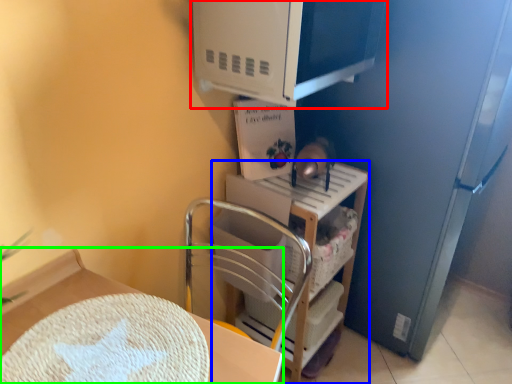
Question: Based on their relative distances, which object is farther from appliance (highlighted by a red box)? Choose from shelf (highlighted by a blue box) and furniture (highlighted by a green box).

Choices:
 (A) shelf
 (B) furniture

Answer: (B)